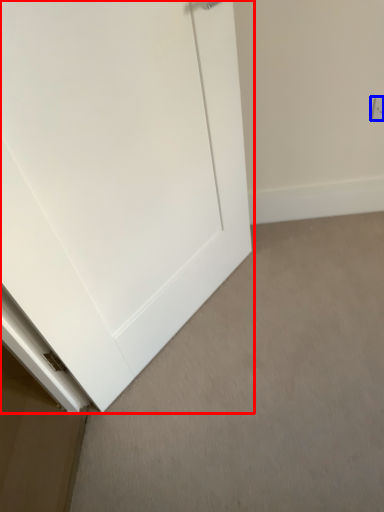
Question: Which of the following is the farthest to the observer, door (highlighted by a red box) or electric outlet (highlighted by a blue box)?

Choices:
 (A) door
 (B) electric outlet

Answer: (B)